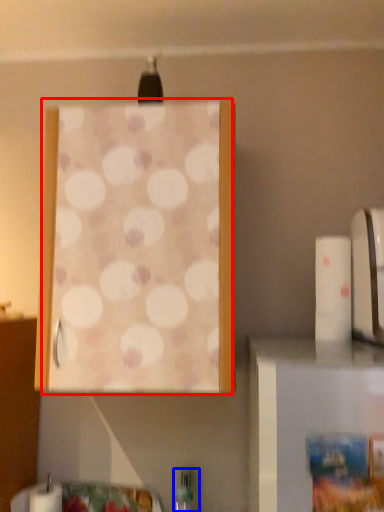
Question: Among these objects, which one is farthest to the camera, curtain (highlighted by a red box) or bottle (highlighted by a blue box)?

Choices:
 (A) curtain
 (B) bottle

Answer: (B)